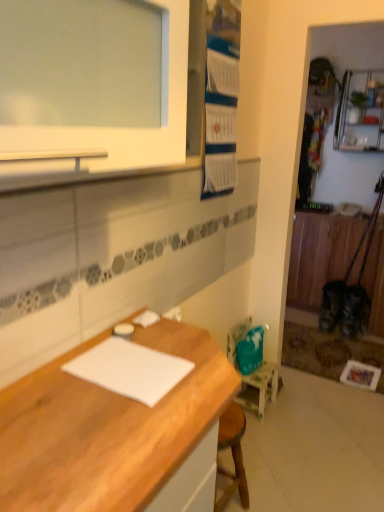
This screenshot has width=384, height=512. What do you see at coordinates (107, 429) in the screenshot?
I see `wooden desk at lower left` at bounding box center [107, 429].

You are a GUI agent. You are given a task and a screenshot of the screen. Output one action in this format:
    pyautogui.click(x=<x>, y=<y>)
    Task: Click on the wooden cabinet at right
    This screenshot has width=384, height=512.
    Given the screenshot: What is the action you would take?
    pyautogui.click(x=319, y=255)

The image size is (384, 512). I want to click on chair below the metallic silver shelf at upper right (from the image's perspective), so pyautogui.click(x=253, y=374).

Based on the photo, from the image's perspective, which object appears higher, metallic silver shelf at upper right or teal fabric chair at lower right?

From the image's view, metallic silver shelf at upper right is above.

Is metallic silver shelf at upper right next to teal fabric chair at lower right and touching it?

metallic silver shelf at upper right and teal fabric chair at lower right are clearly separated.

Considering the points (345, 145) and (275, 380), which point is behind, point (345, 145) or point (275, 380)?

The point (345, 145) is farther.

Is white paper at center shorter than wooden cabinet at right?

Yes, white paper at center is shorter than wooden cabinet at right.

Is white paper at center facing away from wooden cabinet at right?

That's not correct — white paper at center is not looking away from wooden cabinet at right.

Is white paper at center inside the boundaries of wooden cabinet at right, or outside?

white paper at center cannot be found inside wooden cabinet at right.

Which point is more forward, (140, 390) or (309, 304)?

The point (140, 390) is closer.

Is the surface of wooden cabinet at right in direct contact with wooden desk at lower left?

No, wooden cabinet at right is not with wooden desk at lower left.

Is wooden cabinet at right at the left side of wooden desk at lower left?

No, wooden cabinet at right is not to the left of wooden desk at lower left.

Considering the sizes of objects wooden cabinet at right and wooden desk at lower left in the image provided, who is smaller, wooden cabinet at right or wooden desk at lower left?

Smaller between the two is wooden cabinet at right.

The height and width of the screenshot is (512, 384). What are the coordinates of `desk on the left of wooden cabinet at right` in the screenshot? It's located at (107, 429).

From a real-world perspective, who is located lower, white paper at center or teal fabric chair at lower right?

In real-world perspective, teal fabric chair at lower right is lower.

Based on the photo, is white paper at center positioned with its back to teal fabric chair at lower right?

white paper at center does not have its back to teal fabric chair at lower right.

The image size is (384, 512). What are the coordinates of `notepad above the teal fabric chair at lower right (from a real-world perspective)` in the screenshot? It's located at (130, 369).

Can we say white paper at center lies outside teal fabric chair at lower right?

Yes, white paper at center is not within teal fabric chair at lower right.

Can you confirm if wooden desk at lower left is taller than teal fabric chair at lower right?

Indeed, wooden desk at lower left has a greater height compared to teal fabric chair at lower right.

Based on the photo, considering the relative positions of wooden desk at lower left and teal fabric chair at lower right in the image provided, is wooden desk at lower left to the left of teal fabric chair at lower right from the viewer's perspective?

Correct, you'll find wooden desk at lower left to the left of teal fabric chair at lower right.

Based on the photo, which object is further away from the camera taking this photo, wooden desk at lower left or teal fabric chair at lower right?

teal fabric chair at lower right is further away from the camera.

Is wooden desk at lower left bigger or smaller than teal fabric chair at lower right?

In the image, wooden desk at lower left appears to be larger than teal fabric chair at lower right.

Is metallic silver shelf at upper right smaller than wooden cabinet at right?

Correct, metallic silver shelf at upper right occupies less space than wooden cabinet at right.

Is there a large distance between metallic silver shelf at upper right and wooden cabinet at right?

No.

Which of these two, metallic silver shelf at upper right or wooden cabinet at right, stands shorter?

With less height is metallic silver shelf at upper right.

Which object is thinner, metallic silver shelf at upper right or wooden cabinet at right?

With smaller width is wooden cabinet at right.

This screenshot has height=512, width=384. In the image, there is a metallic silver shelf at upper right. Identify the location of desk below it (from a real-world perspective). (107, 429).

Are metallic silver shelf at upper right and wooden desk at lower left beside each other?

They are not placed beside each other.

Consider the image. Can you confirm if metallic silver shelf at upper right is thinner than wooden desk at lower left?

Yes, metallic silver shelf at upper right is thinner than wooden desk at lower left.

Find the location of a particular element. chair below the metallic silver shelf at upper right (from the image's perspective) is located at coordinates (253, 374).

This screenshot has height=512, width=384. Identify the location of notepad lying in front of the wooden cabinet at right. (130, 369).

When comparing their distances from metallic silver shelf at upper right, does white paper at center or wooden desk at lower left seem closer?

wooden desk at lower left is closer to metallic silver shelf at upper right.

When comparing their distances from wooden cabinet at right, does teal fabric chair at lower right or metallic silver shelf at upper right seem closer?

metallic silver shelf at upper right lies closer to wooden cabinet at right than the other object.

Which object lies nearer to the anchor point white paper at center, wooden desk at lower left or wooden cabinet at right?

Based on the image, wooden desk at lower left appears to be nearer to white paper at center.

Based on their spatial positions, is metallic silver shelf at upper right or wooden cabinet at right further from white paper at center?

Based on the image, metallic silver shelf at upper right appears to be further to white paper at center.

Estimate the real-world distances between objects in this image. Which object is further from white paper at center, teal fabric chair at lower right or metallic silver shelf at upper right?

Among the two, metallic silver shelf at upper right is located further to white paper at center.

Looking at the image, which one is located further to wooden desk at lower left, wooden cabinet at right or teal fabric chair at lower right?

Among the two, wooden cabinet at right is located further to wooden desk at lower left.

From the image, which object appears to be farther from wooden cabinet at right, metallic silver shelf at upper right or white paper at center?

white paper at center lies further to wooden cabinet at right than the other object.

From the image, which object appears to be farther from teal fabric chair at lower right, white paper at center or wooden desk at lower left?

The object further to teal fabric chair at lower right is wooden desk at lower left.

Locate an element on the screen. The height and width of the screenshot is (512, 384). chair located between white paper at center and metallic silver shelf at upper right in the depth direction is located at coordinates (253, 374).

I want to click on notepad located between wooden desk at lower left and teal fabric chair at lower right in the depth direction, so click(130, 369).

At what (x,y) coordinates should I click in order to perform the action: click on cabinetry between metallic silver shelf at upper right and teal fabric chair at lower right in the vertical direction. Please return your answer as a coordinate pair (x, y). This screenshot has width=384, height=512. Looking at the image, I should click on (319, 255).

The height and width of the screenshot is (512, 384). In order to click on notepad positioned between wooden desk at lower left and metallic silver shelf at upper right from near to far in this screenshot , I will do `click(130, 369)`.